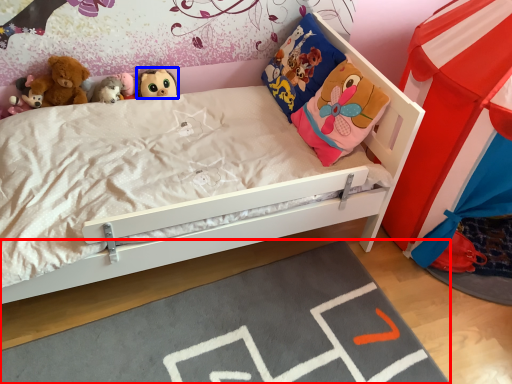
Question: Which point is further to the camera, plain (highlighted by a red box) or toy (highlighted by a blue box)?

Choices:
 (A) plain
 (B) toy

Answer: (B)